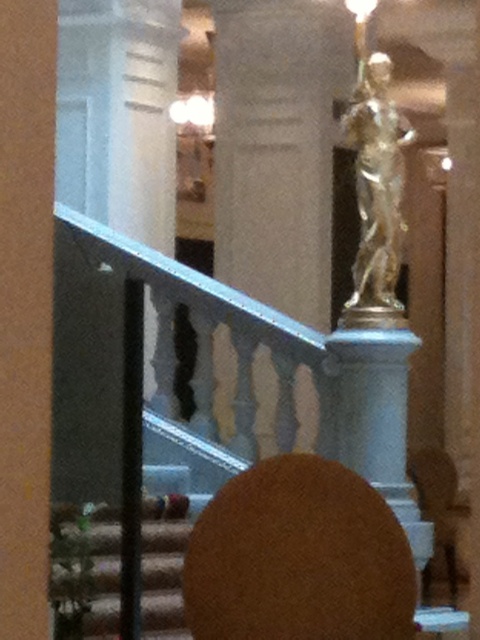
You are an architect designing a new museum exhibit and need to place a 2.5 meter tall sculpture. You have two options for placement locations in the image provided. The first location is near the white marble pillar at center, and the second is near the gold metallic statue at upper center. Based on the height of the existing objects, which location would allow the sculpture to fit without exceeding the vertical space available?

The white marble pillar at center has a greater height compared to the gold metallic statue at upper center. Therefore, placing the 2.5 meter tall sculpture near the gold metallic statue at upper center would be more appropriate as the available vertical space there is sufficient to accommodate the sculpture without exceeding height constraints.

You are a visitor standing at the entrance of the building and want to sit on the brown leather chair at lower right. Can you see the chair from your current position, considering the white marble pillar at center?

The brown leather chair at lower right is behind the white marble pillar at center, so you cannot see it from your current position at the entrance.